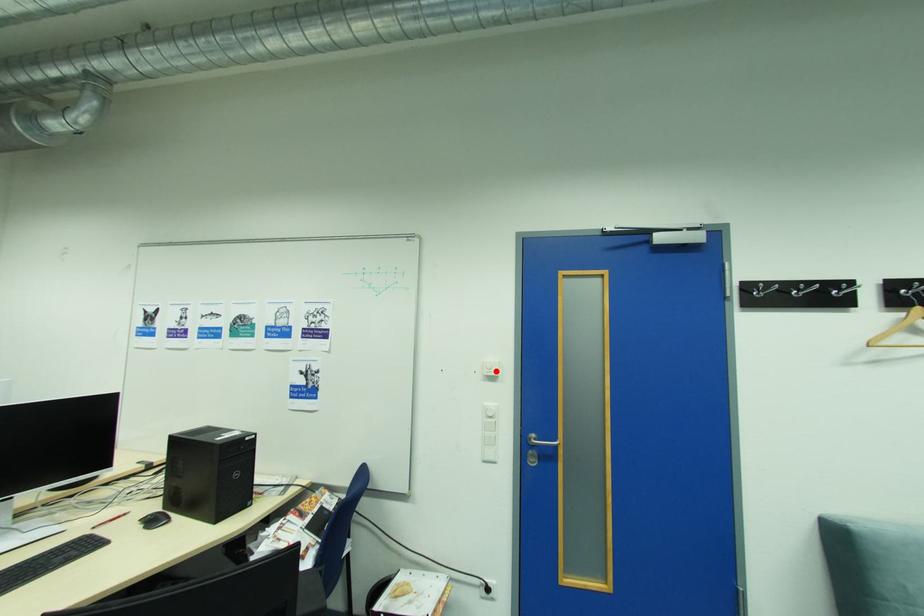
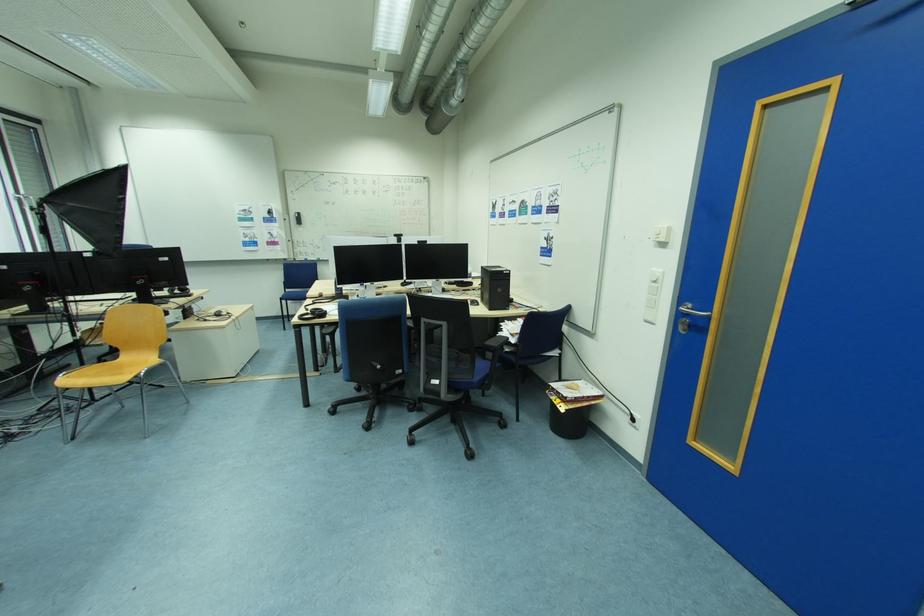
Find the pixel in the second image that matches the highlighted location in the first image.

(664, 237)